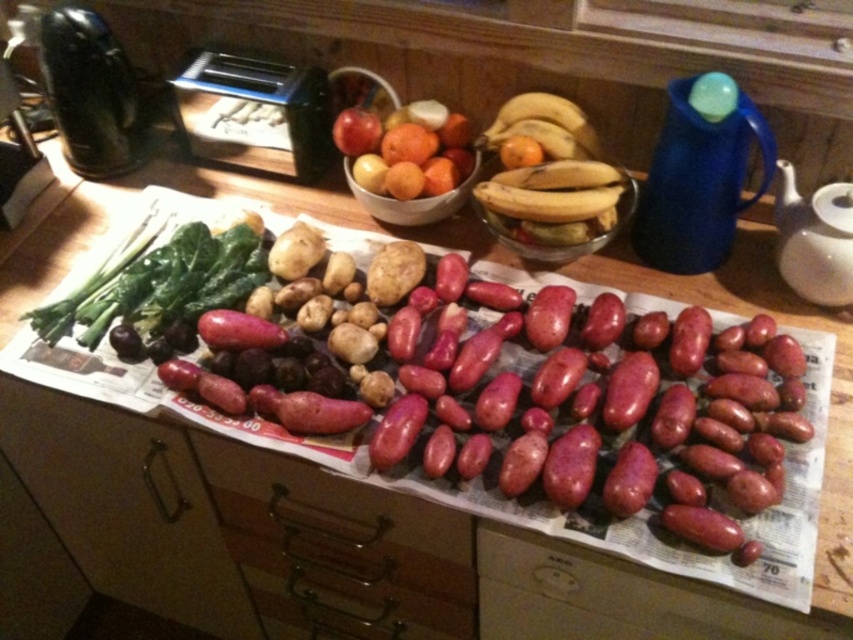
Question: Is green leafy at left positioned at the back of glossy plastic bowl at center?

Choices:
 (A) no
 (B) yes

Answer: (A)

Question: Among these points, which one is farthest from the camera?

Choices:
 (A) (93, 342)
 (B) (367, 170)

Answer: (B)

Question: Is green leafy at left above glossy plastic bowl at center?

Choices:
 (A) no
 (B) yes

Answer: (A)

Question: Considering the relative positions of green leafy at left and glossy plastic bowl at center in the image provided, where is green leafy at left located with respect to glossy plastic bowl at center?

Choices:
 (A) above
 (B) below

Answer: (B)